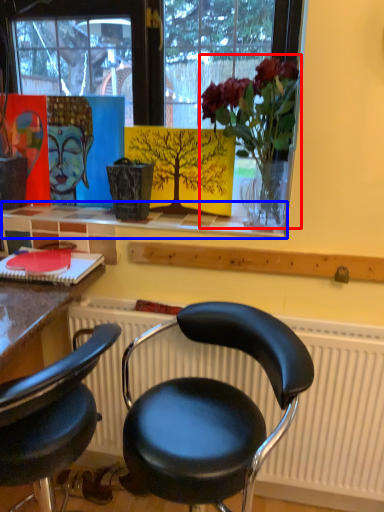
Question: Which object is further to the camera taking this photo, floral arrangement (highlighted by a red box) or window sill (highlighted by a blue box)?

Choices:
 (A) floral arrangement
 (B) window sill

Answer: (B)